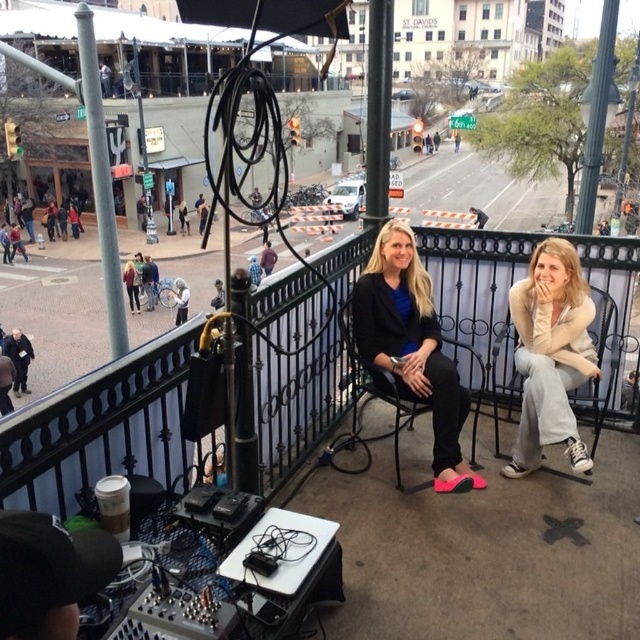
You are standing on the balcony and want to place a decorative plant exactly at the center of the matte black blazer at center. What are the coordinates where you should place the plant?

The coordinates for the matte black blazer at center are (412, 346), so you should place the decorative plant at those exact coordinates.

Based on the photo, you are a photographer positioned at the scene. You want to take a photo that includes both the matte black blazer at center and the white fabric umbrella at upper center. Which object should you adjust to ensure both are fully visible in the frame?

The matte black blazer at center is in front of the white fabric umbrella at upper center. To ensure both are fully visible, you should move the matte black blazer at center slightly backward or reposition the white fabric umbrella at upper center to the side so that they are not overlapping in the frame.

In the scene shown: You are a photographer trying to capture a clear shot of the matte black blazer at center and the white fabric umbrella at upper center. Which object should you focus on first if you want to ensure both are in focus without adjusting the camera settings?

The matte black blazer at center is taller than the white fabric umbrella at upper center, so focusing on the matte black blazer at center first would help ensure both are in focus since it is closer to the camera.